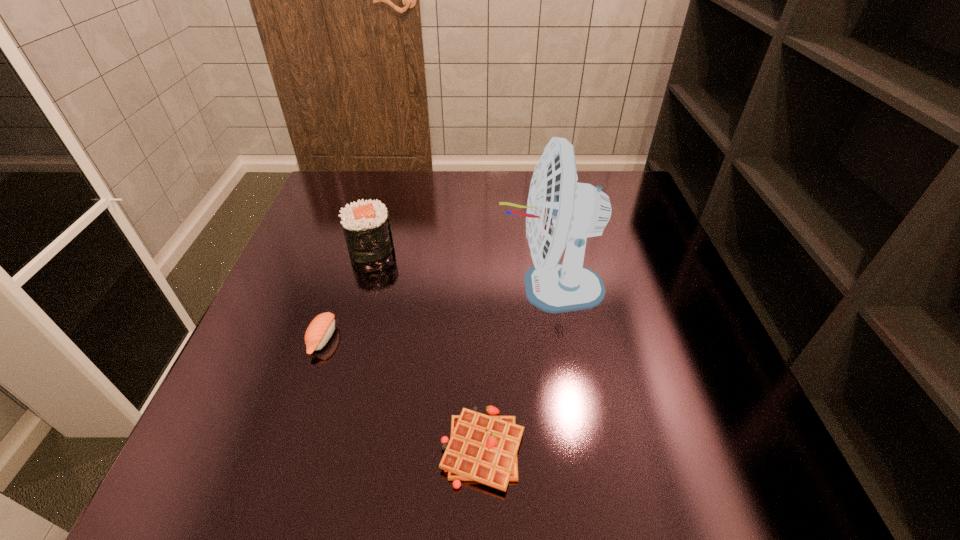
You are a GUI agent. You are given a task and a screenshot of the screen. Output one action in this format:
    pyautogui.click(x=<x>, y=<y>)
    Task: Click on the free space located 0.130m on the left of the third shortest object
    
    Given the screenshot: What is the action you would take?
    pyautogui.click(x=294, y=247)

This screenshot has width=960, height=540. In order to click on free space located on the front of the nearer sushi in this screenshot , I will do `click(283, 457)`.

You are a GUI agent. You are given a task and a screenshot of the screen. Output one action in this format:
    pyautogui.click(x=<x>, y=<y>)
    Task: Click on the free space located on the left of the shortest object
    Image resolution: width=960 pixels, height=540 pixels.
    Given the screenshot: What is the action you would take?
    pyautogui.click(x=304, y=449)

Image resolution: width=960 pixels, height=540 pixels. Identify the location of object that is positioned at the near edge. (482, 448).

Find the location of a particular element. This screenshot has height=540, width=960. vacant region at the far edge of the desktop is located at coordinates coord(397,180).

Locate an element on the screen. free space at the left edge is located at coordinates (339, 232).

Locate an element on the screen. This screenshot has width=960, height=540. vacant space at the right edge of the desktop is located at coordinates (709, 379).

I want to click on vacant space at the far left corner of the desktop, so click(342, 176).

Image resolution: width=960 pixels, height=540 pixels. I want to click on vacant region at the near right corner of the desktop, so click(681, 447).

Locate an element on the screen. free point between the farther sushi and the waffle is located at coordinates (427, 348).